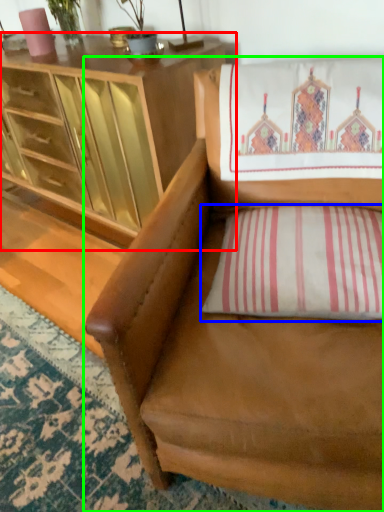
Question: Which object is positioned farthest from cabinetry (highlighted by a red box)? Select from pillow (highlighted by a blue box) and chair (highlighted by a green box).

Choices:
 (A) pillow
 (B) chair

Answer: (A)